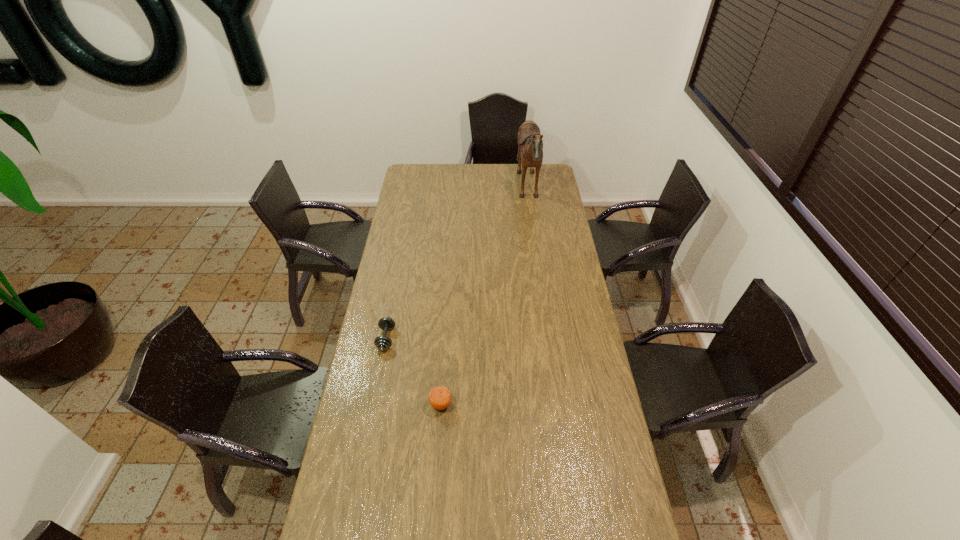
Find the location of a particular element. Image resolution: width=960 pixels, height=540 pixels. the rightmost object is located at coordinates (530, 144).

Identify the location of saddle. (530, 144).

Locate an element on the screen. The height and width of the screenshot is (540, 960). the second tallest object is located at coordinates (439, 397).

Where is `the nearest object`? The width and height of the screenshot is (960, 540). the nearest object is located at coordinates (439, 397).

You are a GUI agent. You are given a task and a screenshot of the screen. Output one action in this format:
    pyautogui.click(x=<x>, y=<y>)
    Task: Click on the leftmost object
    The width and height of the screenshot is (960, 540).
    Given the screenshot: What is the action you would take?
    pyautogui.click(x=382, y=343)

At what (x,y) coordinates should I click in order to perform the action: click on dumbbell. Please return your answer as a coordinate pair (x, y). Looking at the image, I should click on (382, 343).

The width and height of the screenshot is (960, 540). I want to click on free space located 0.070m on the back of the rightmost object, so click(504, 191).

Identify the location of blank space located 0.080m on the back of the rightmost object. (502, 191).

In order to click on vacant area situated 0.130m on the back of the rightmost object in this screenshot , I will do `click(493, 191)`.

Where is `vacant area located on the left of the second object from right to left`? vacant area located on the left of the second object from right to left is located at coordinates click(x=385, y=404).